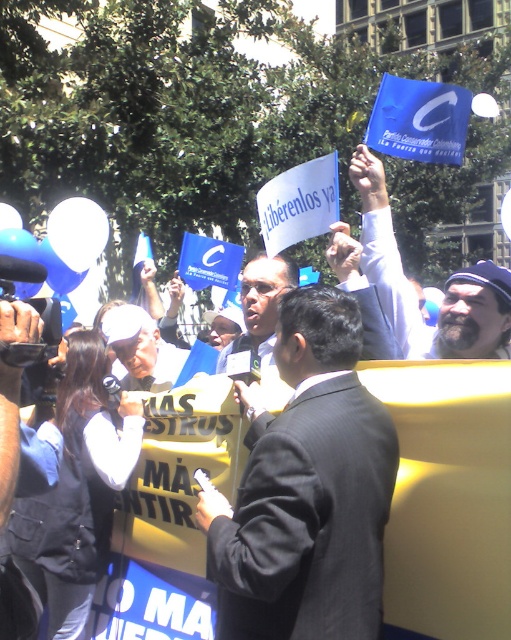
Is black fabric vest at center above blue fabric flag at upper right?

Actually, black fabric vest at center is below blue fabric flag at upper right.

Does black fabric vest at center have a smaller size compared to blue fabric flag at upper right?

No.

In order to click on black fabric vest at center in this screenshot , I will do `click(78, 490)`.

Who is taller, dark gray suit at center or black fabric vest at center?

black fabric vest at center

Which is below, dark gray suit at center or black fabric vest at center?

black fabric vest at center

Identify the location of dark gray suit at center. [307, 490].

Does point (221, 499) come behind point (445, 352)?

That is False.

Who is positioned more to the left, dark gray suit at center or blue fabric flag at upper right?

dark gray suit at center

Where is `dark gray suit at center`? The image size is (511, 640). dark gray suit at center is located at coordinates (307, 490).